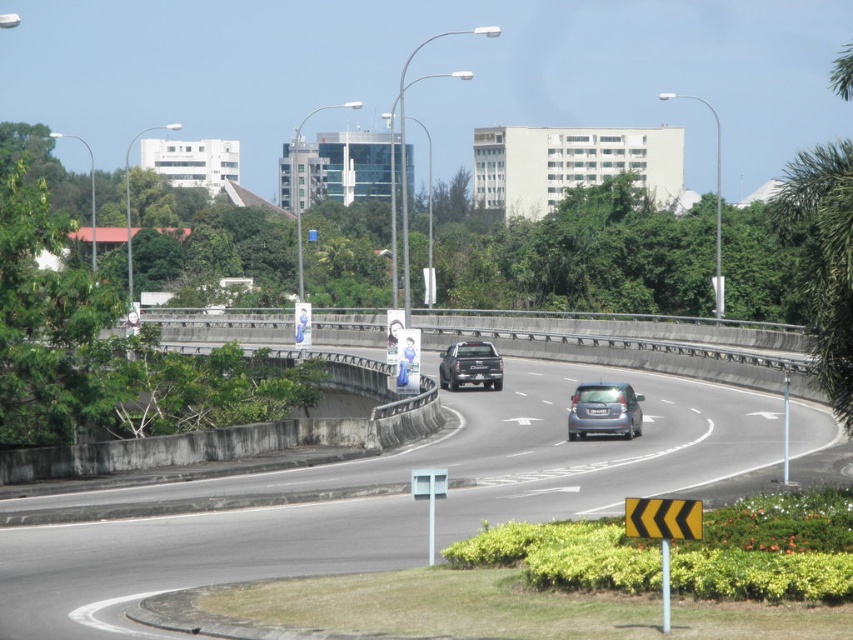
Is point (341, 525) positioned in front of point (492, 355)?

Yes, point (341, 525) is in front of point (492, 355).

Between point (154, 579) and point (502, 368), which one is positioned in front?

Point (154, 579) is in front.

Does point (492, 451) lie behind point (440, 356)?

No, (492, 451) is closer to viewer.

Identify the location of smooth asphalt road at center. This screenshot has width=853, height=640. (383, 499).

Who is more distant from viewer, (525, 371) or (619, 412)?

Point (525, 371)

Is smooth asphalt road at center in front of satin silver hatchback at center?

That is True.

What do you see at coordinates (383, 499) in the screenshot? I see `smooth asphalt road at center` at bounding box center [383, 499].

The height and width of the screenshot is (640, 853). I want to click on smooth asphalt road at center, so click(x=383, y=499).

Is satin silver hatchback at center positioned before matte black truck at center?

Yes, satin silver hatchback at center is in front of matte black truck at center.

Who is lower down, satin silver hatchback at center or matte black truck at center?

satin silver hatchback at center is below.

Between point (630, 426) and point (492, 376), which one is positioned in front?

Point (630, 426) is in front.

The height and width of the screenshot is (640, 853). In order to click on satin silver hatchback at center in this screenshot , I will do `click(604, 410)`.